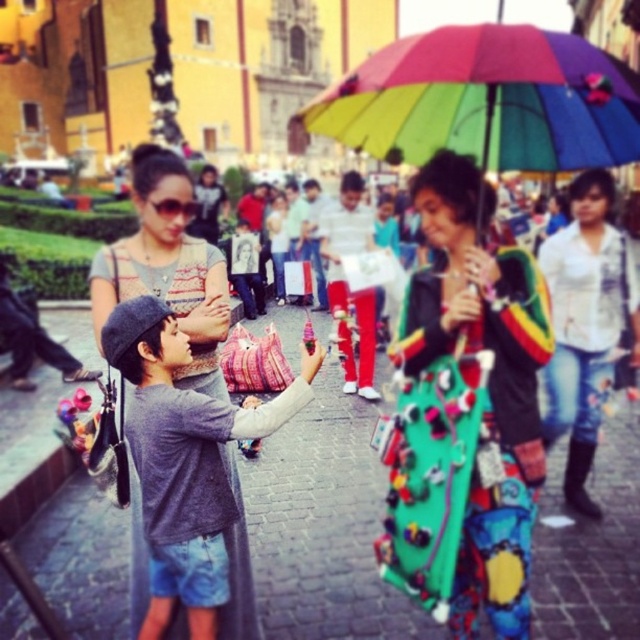
You are a street performer standing in the plaza. You have a multicolored fabric umbrella at center and a rainbow fabric umbrella at center. Which umbrella is shorter?

The multicolored fabric umbrella at center is shorter than the rainbow fabric umbrella at center.